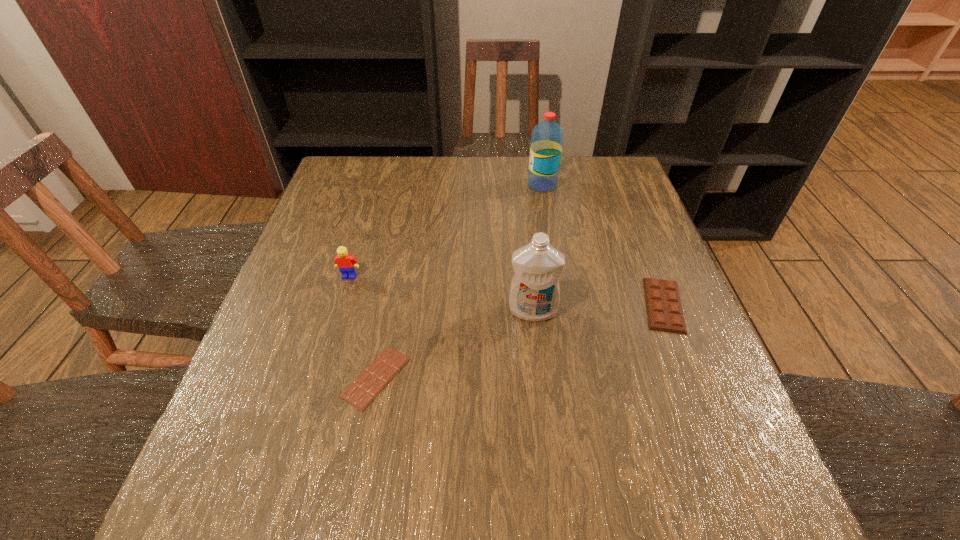
Identify the location of vacant point located 0.220m on the front label of the water bottle. The width and height of the screenshot is (960, 540). (454, 185).

Where is `vacant region located 0.170m on the left of the detergent`? The image size is (960, 540). vacant region located 0.170m on the left of the detergent is located at coordinates (431, 311).

The image size is (960, 540). I want to click on free space located on the front-facing side of the Lego, so click(x=325, y=357).

Find the location of `vacant space located on the left of the taller chocolate bar`. vacant space located on the left of the taller chocolate bar is located at coordinates (515, 305).

Where is `vacant space located on the back of the fourth object from right to left`? vacant space located on the back of the fourth object from right to left is located at coordinates (386, 323).

In order to click on object at the far edge in this screenshot , I will do `click(547, 137)`.

Where is `object located at the left edge`? object located at the left edge is located at coordinates (346, 263).

At what (x,y) coordinates should I click in order to perform the action: click on object present at the right edge. Please return your answer as a coordinate pair (x, y). Looking at the image, I should click on (664, 310).

Locate an element on the screen. The image size is (960, 540). free space at the far edge of the desktop is located at coordinates (520, 192).

The width and height of the screenshot is (960, 540). Identify the location of vacant position at the near edge of the desktop. [x=587, y=483].